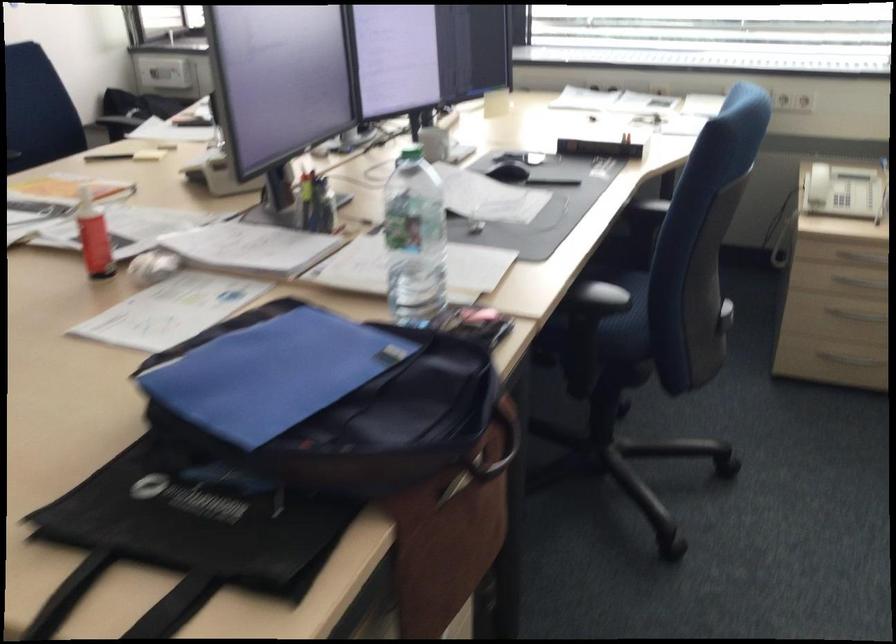
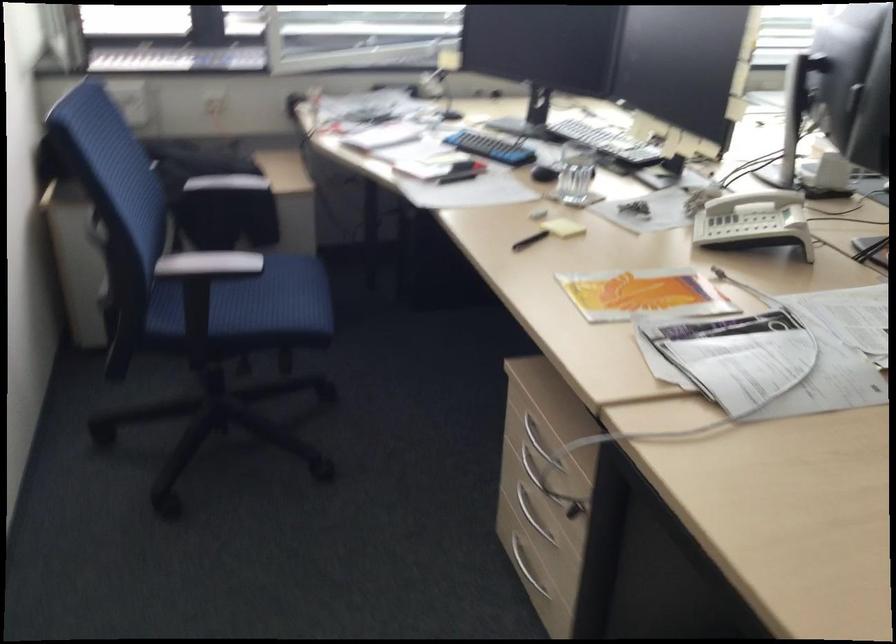
Find the pixel in the second image that matches pixel 108 154 in the first image.

(530, 240)